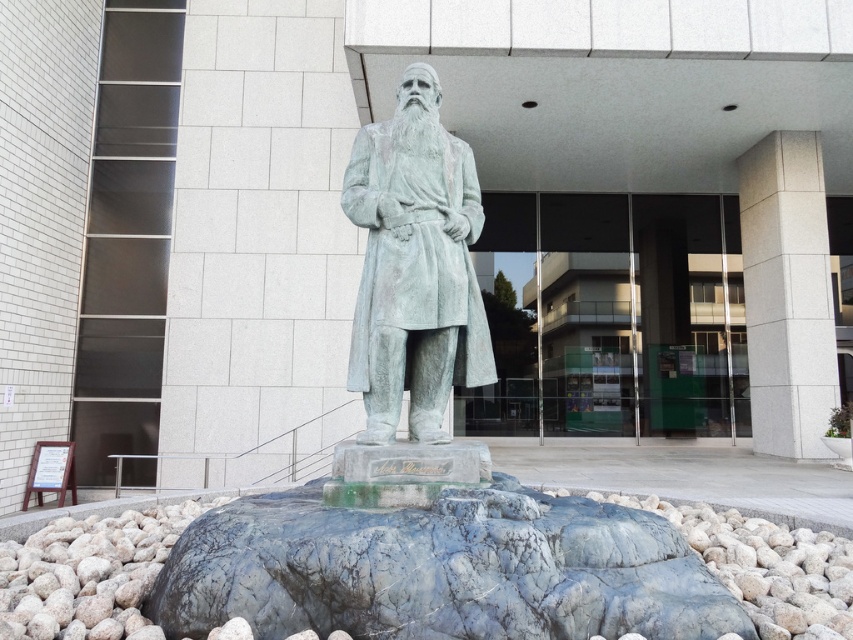
Is green marble fountain at center thinner than green patina statue at center?

In fact, green marble fountain at center might be wider than green patina statue at center.

Between green marble fountain at center and green patina statue at center, which one is positioned higher?

Positioned higher is green patina statue at center.

Who is more distant from viewer, [471,198] or [444,308]?

The point [471,198] is behind.

Locate an element on the screen. The width and height of the screenshot is (853, 640). green marble fountain at center is located at coordinates (428, 464).